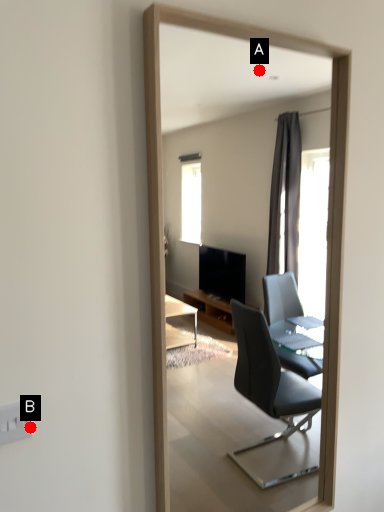
Question: Two points are circled on the image, labeled by A and B beside each circle. Which of the following is the closest to the observer?

Choices:
 (A) A is closer
 (B) B is closer

Answer: (B)